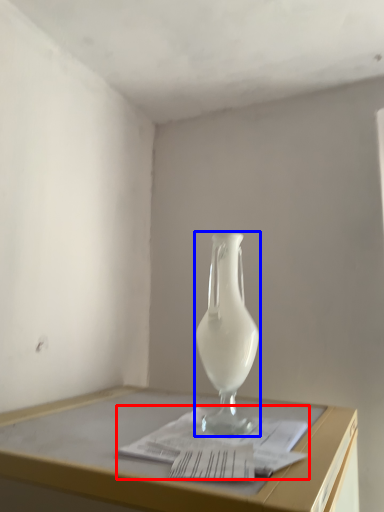
Question: Which object is further to the camera taking this photo, magazine (highlighted by a red box) or vase (highlighted by a blue box)?

Choices:
 (A) magazine
 (B) vase

Answer: (B)